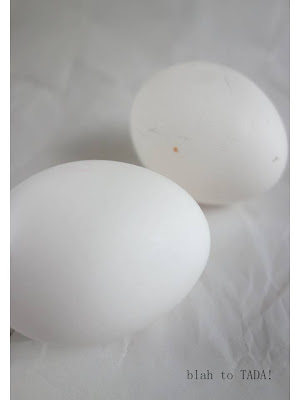
Identify the location of white surface. Image resolution: width=300 pixels, height=400 pixels. (234, 291).